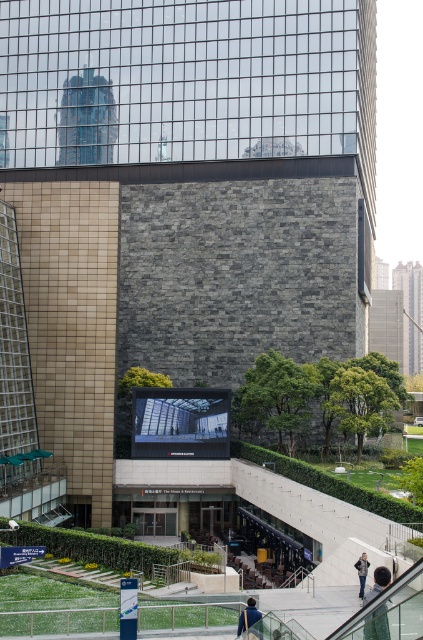
Can you confirm if dark brown hair at lower right is positioned above denim jacket at lower center?

Correct, dark brown hair at lower right is located above denim jacket at lower center.

Is point (390, 636) more distant than point (359, 588)?

No, (390, 636) is in front of (359, 588).

Who is more distant from viewer, (386, 627) or (360, 593)?

Point (360, 593)

Locate an element on the screen. The height and width of the screenshot is (640, 423). dark brown hair at lower right is located at coordinates (376, 625).

Who is more distant from viewer, (244, 618) or (365, 570)?

Point (365, 570)

Who is taller, blue fabric jacket at lower center or denim jacket at lower center?

denim jacket at lower center is taller.

Between point (249, 611) and point (362, 595), which one is positioned in front?

Point (249, 611)

I want to click on blue fabric jacket at lower center, so click(249, 620).

Is point (364, 632) more distant than point (260, 611)?

No, it is not.

Describe the element at coordinates (376, 625) in the screenshot. I see `dark brown hair at lower right` at that location.

You are a GUI agent. You are given a task and a screenshot of the screen. Output one action in this format:
    pyautogui.click(x=<x>, y=<y>)
    Task: Click on the dark brown hair at lower right
    Image resolution: width=423 pixels, height=640 pixels.
    Given the screenshot: What is the action you would take?
    pyautogui.click(x=376, y=625)